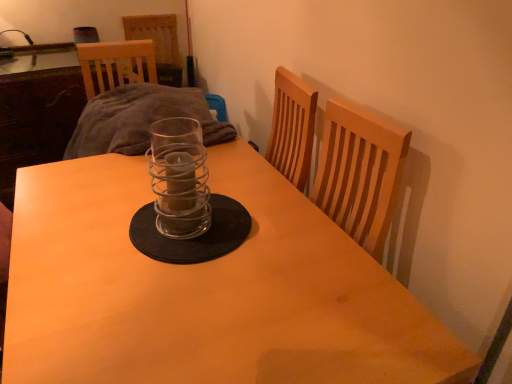
Question: Is wooden table at center completely or partially outside of clear glass candle holder at center?

Choices:
 (A) no
 (B) yes

Answer: (B)

Question: Is wooden table at center in contact with clear glass candle holder at center?

Choices:
 (A) yes
 (B) no

Answer: (B)

Question: Can you confirm if wooden table at center is positioned to the right of clear glass candle holder at center?

Choices:
 (A) no
 (B) yes

Answer: (A)

Question: Can you confirm if wooden table at center is positioned to the left of clear glass candle holder at center?

Choices:
 (A) no
 (B) yes

Answer: (B)

Question: Is wooden table at center turned away from clear glass candle holder at center?

Choices:
 (A) yes
 (B) no

Answer: (B)

Question: From the image's perspective, is wooden table at center located beneath clear glass candle holder at center?

Choices:
 (A) no
 (B) yes

Answer: (B)

Question: Is the surface of clear glass candle holder at center in direct contact with wooden table at center?

Choices:
 (A) yes
 (B) no

Answer: (B)

Question: Can you confirm if clear glass candle holder at center is shorter than wooden table at center?

Choices:
 (A) yes
 (B) no

Answer: (A)

Question: Does clear glass candle holder at center have a larger size compared to wooden table at center?

Choices:
 (A) yes
 (B) no

Answer: (B)

Question: Is clear glass candle holder at center positioned in front of wooden table at center?

Choices:
 (A) yes
 (B) no

Answer: (B)

Question: Is clear glass candle holder at center positioned with its back to wooden table at center?

Choices:
 (A) yes
 (B) no

Answer: (B)

Question: Is clear glass candle holder at center far away from wooden table at center?

Choices:
 (A) no
 (B) yes

Answer: (A)

Question: Relative to wooden table at center, is clear glass candle holder at center in front or behind?

Choices:
 (A) front
 (B) behind

Answer: (B)